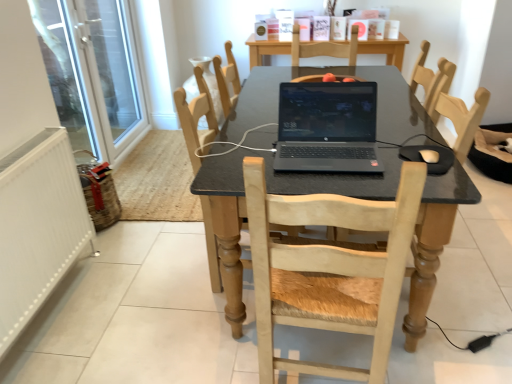
Question: From the image's perspective, is white glass screen door at left on light wood chair at center, which ranks as the 1th chair in front-to-back order?

Choices:
 (A) no
 (B) yes

Answer: (B)

Question: Is light wood chair at center, which ranks as the 1th chair in front-to-back order, located within white glass screen door at left?

Choices:
 (A) yes
 (B) no

Answer: (B)

Question: Is white glass screen door at left taller than light wood chair at center, the 3th chair positioned from the back?

Choices:
 (A) no
 (B) yes

Answer: (B)

Question: Does white glass screen door at left have a greater width compared to light wood chair at center, the 3th chair positioned from the back?

Choices:
 (A) no
 (B) yes

Answer: (A)

Question: Is white glass screen door at left positioned far away from light wood chair at center, the 3th chair positioned from the back?

Choices:
 (A) yes
 (B) no

Answer: (A)

Question: Is white glass screen door at left oriented towards light wood chair at center, the 3th chair positioned from the back?

Choices:
 (A) yes
 (B) no

Answer: (B)

Question: Is light wood chair at center, which is counted as the 2th chair, starting from the back, facing away from white matte mouse at lower right?

Choices:
 (A) yes
 (B) no

Answer: (B)

Question: Is light wood chair at center, which ranks as the second chair in front-to-back order, oriented towards white matte mouse at lower right?

Choices:
 (A) yes
 (B) no

Answer: (A)

Question: Is light wood chair at center, which is counted as the 2th chair, starting from the back, to the right of white matte mouse at lower right from the viewer's perspective?

Choices:
 (A) no
 (B) yes

Answer: (A)

Question: From the image's perspective, would you say light wood chair at center, which ranks as the second chair in front-to-back order, is shown under white matte mouse at lower right?

Choices:
 (A) yes
 (B) no

Answer: (A)

Question: From a real-world perspective, is light wood chair at center, which ranks as the second chair in front-to-back order, over white matte mouse at lower right?

Choices:
 (A) yes
 (B) no

Answer: (B)

Question: Are light wood chair at center, which ranks as the second chair in front-to-back order, and white matte mouse at lower right making contact?

Choices:
 (A) no
 (B) yes

Answer: (A)

Question: Does white matte mouse at lower right have a smaller size compared to white glass screen door at left?

Choices:
 (A) no
 (B) yes

Answer: (B)